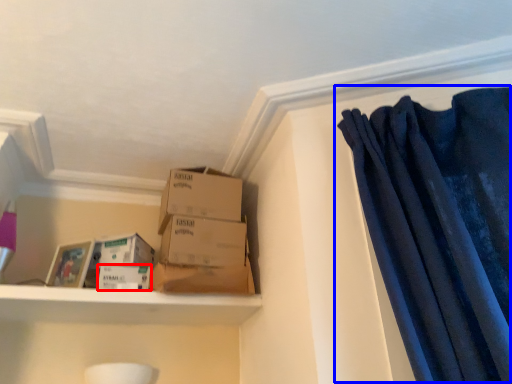
Question: Among these objects, which one is farthest to the camera, storage box (highlighted by a red box) or curtain (highlighted by a blue box)?

Choices:
 (A) storage box
 (B) curtain

Answer: (A)